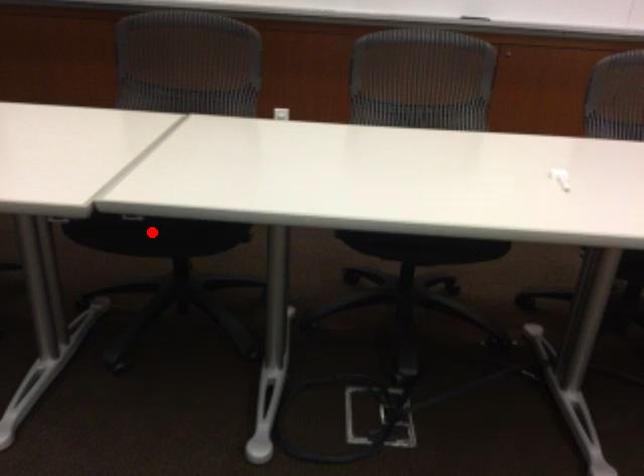
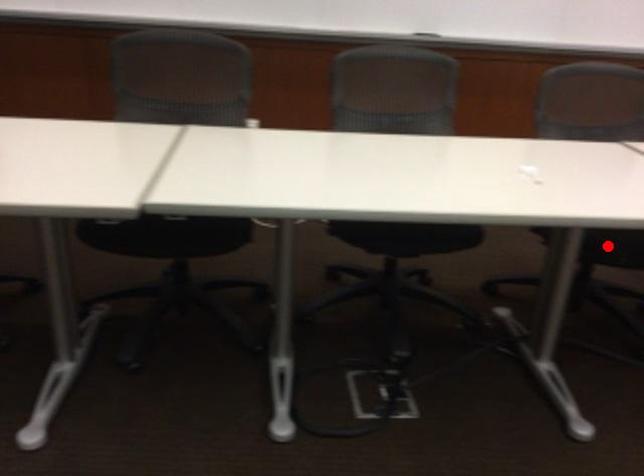
I am providing you with two images of the same scene from different viewpoints. A red point is marked on the first image and another point is marked on the second image. Do the highlighted points in image1 and image2 indicate the same real-world spot?

No